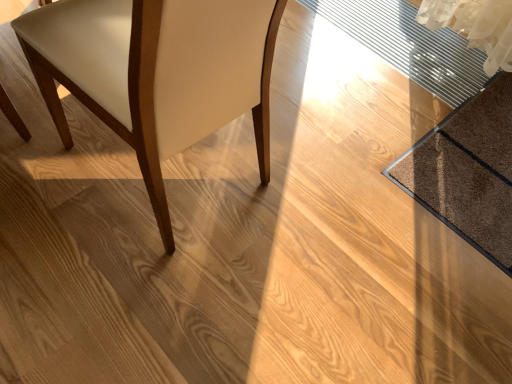
I want to click on free location to the right of matte white chair at center, so click(322, 195).